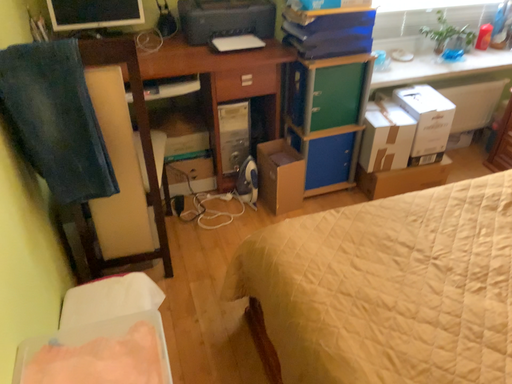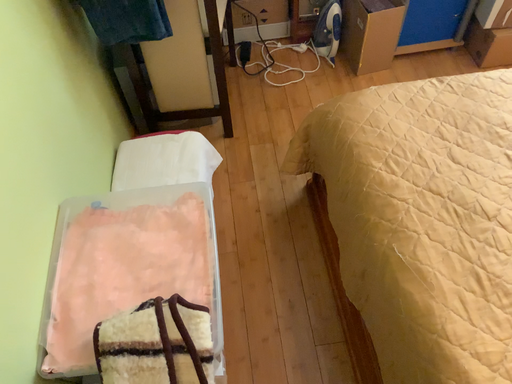
Question: How did the camera likely rotate when shooting the video?

Choices:
 (A) rotated right
 (B) rotated left

Answer: (B)